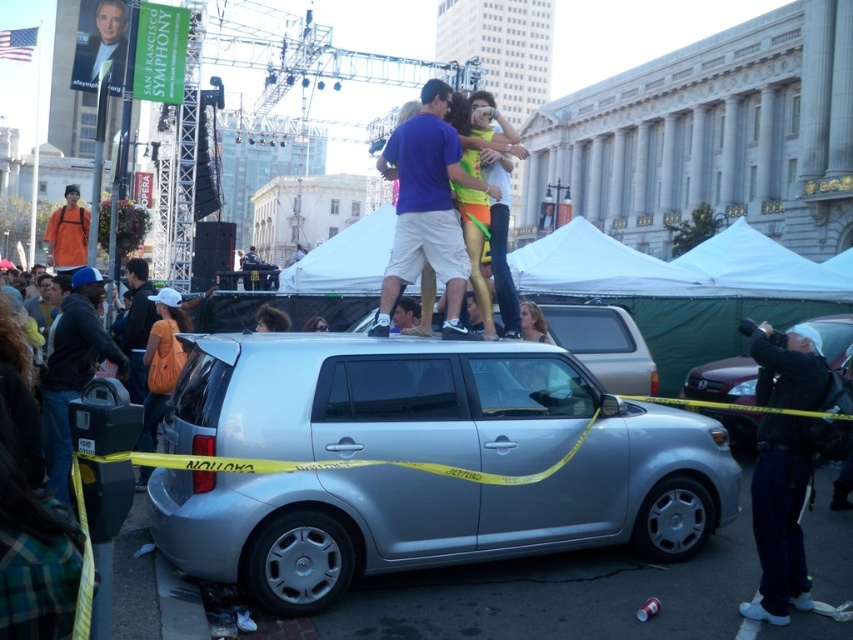
Question: Can you confirm if satin silver suv at center is positioned to the left of matte black camera at right?

Choices:
 (A) no
 (B) yes

Answer: (B)

Question: Which of the following is the closest to the observer?

Choices:
 (A) (392, 291)
 (B) (514, 378)

Answer: (B)

Question: Where is satin silver suv at center located in relation to matte blue shirt at center in the image?

Choices:
 (A) above
 (B) below

Answer: (B)

Question: Considering the real-world distances, which object is farthest from the dark blue jacket at left?

Choices:
 (A) matte blue shirt at center
 (B) matte black camera at right
 (C) satin silver suv at center
 (D) silver metallic hatchback at center

Answer: (D)

Question: Does satin silver suv at center have a greater width compared to dark blue jacket at left?

Choices:
 (A) no
 (B) yes

Answer: (B)

Question: Which point is farther to the camera?

Choices:
 (A) (712, 388)
 (B) (788, 403)
 (C) (283, 541)
 (D) (447, 140)

Answer: (A)